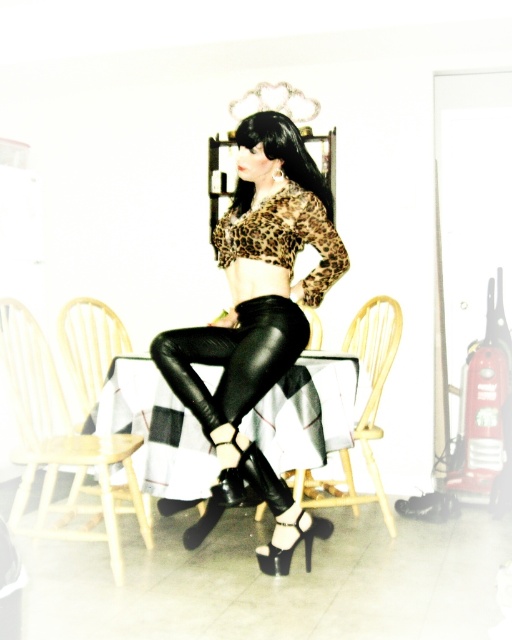
Between black leather chair at center and wooden chair at center, which one has more height?

With more height is black leather chair at center.

Is point (372, 372) positioned behind point (110, 356)?

Yes, point (372, 372) is behind point (110, 356).

This screenshot has height=640, width=512. Describe the element at coordinates (360, 412) in the screenshot. I see `black leather chair at center` at that location.

What are the coordinates of `black leather chair at center` in the screenshot? It's located at (360, 412).

Is wooden chair at center above white matte stocking at lower center?

Indeed, wooden chair at center is positioned over white matte stocking at lower center.

This screenshot has height=640, width=512. What are the coordinates of `wooden chair at center` in the screenshot? It's located at (90, 344).

Does leopard print fabric at center have a larger size compared to white matte stocking at lower center?

Indeed, leopard print fabric at center has a larger size compared to white matte stocking at lower center.

Where is `leopard print fabric at center`? This screenshot has height=640, width=512. leopard print fabric at center is located at coordinates (258, 321).